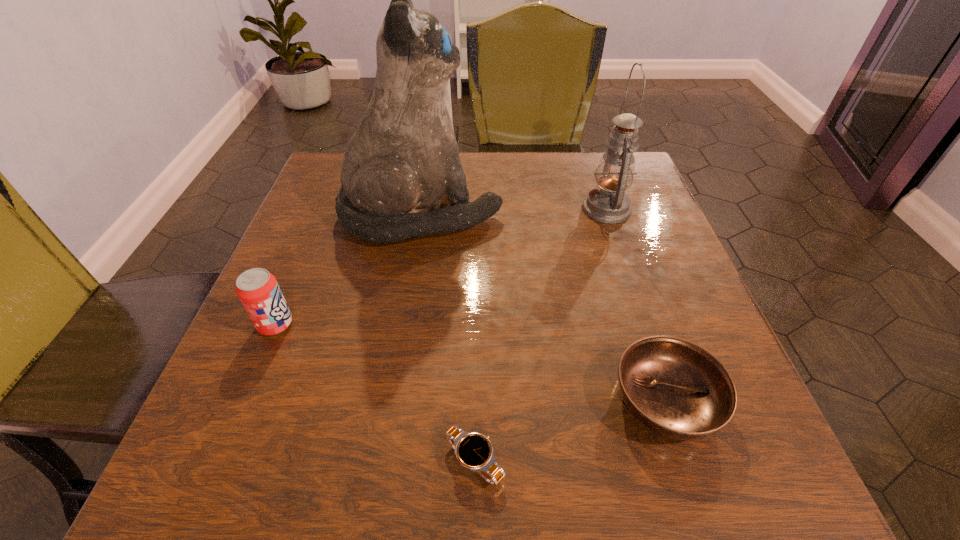
This screenshot has width=960, height=540. I want to click on vacant space located 0.140m on the right of the shortest object, so click(x=609, y=461).

You are a GUI agent. You are given a task and a screenshot of the screen. Output one action in this format:
    pyautogui.click(x=<x>, y=<y>)
    Task: Click on the cat that is at the far edge
    This screenshot has width=960, height=540.
    Given the screenshot: What is the action you would take?
    pyautogui.click(x=403, y=157)

Where is `oil lamp that is at the far edge`? Image resolution: width=960 pixels, height=540 pixels. oil lamp that is at the far edge is located at coordinates (608, 203).

You are a GUI agent. You are given a task and a screenshot of the screen. Output one action in this format:
    pyautogui.click(x=<x>, y=<y>)
    Task: Click on the soup bowl positioned at the near edge
    This screenshot has height=540, width=960.
    Given the screenshot: What is the action you would take?
    pyautogui.click(x=674, y=387)

This screenshot has height=540, width=960. Find the location of `watch located in the near edge section of the desktop`. watch located in the near edge section of the desktop is located at coordinates (474, 451).

What are the coordinates of `cat that is at the left edge` in the screenshot? It's located at (403, 157).

At what (x,y) coordinates should I click in order to perform the action: click on soda can positioned at the left edge. Please return your answer as a coordinate pair (x, y). Looking at the image, I should click on (258, 290).

Find the location of a particular element. This screenshot has height=540, width=960. oil lamp located at the right edge is located at coordinates (608, 203).

This screenshot has width=960, height=540. What are the coordinates of `soup bowl at the right edge` in the screenshot? It's located at (674, 387).

Locate an element on the screen. Image resolution: width=960 pixels, height=540 pixels. object at the far left corner is located at coordinates (403, 157).